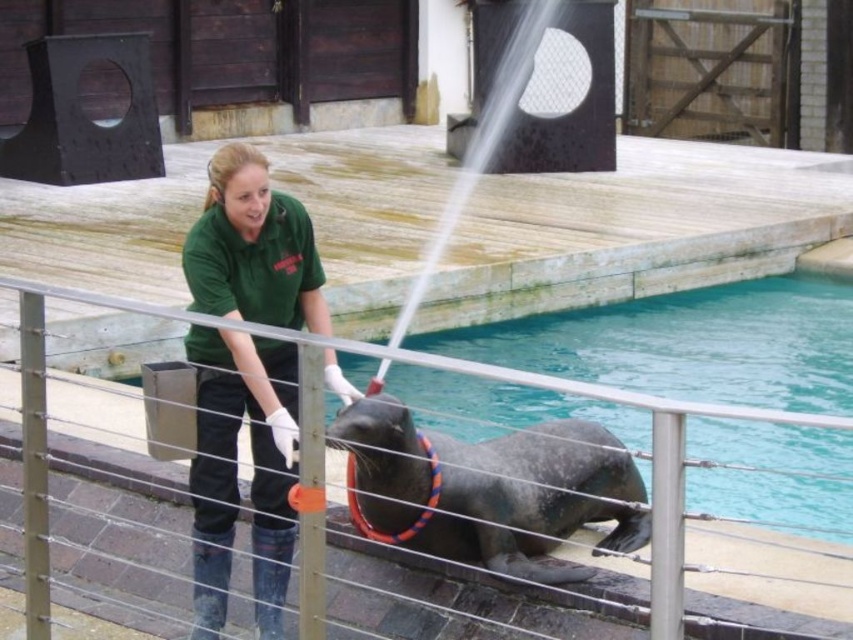
You are a zookeeper who needs to clean the seal area. The hose you are using has a maximum reach of 8 feet. Can you safely spray the gray rubber seal at center from your current position near the metal wire rail at center without moving closer?

The distance between the gray rubber seal at center and the metal wire rail at center is 8.11 feet, which exceeds the hose reach of 8 feet. Therefore, you cannot safely spray the seal without moving closer.

You are a zookeeper who needs to clean the seal area. You have a mop and bucket nearby. The blue smooth water at lower center is an obstacle. Can you walk from your current position at the green uniform at center to the mop and bucket without stepping into the water?

The blue smooth water at lower center is to the right of green uniform at center. Since the water is to the right of your position, you can walk around it either to the left or behind to reach the mop and bucket without stepping into the water.

You are a zookeeper trying to locate the blue smooth water at lower center in the scene. Based on the coordinates provided, where exactly would you find it?

The blue smooth water at lower center is located at point coordinates of 0.537 on the x axis and 0.808 on the y axis.